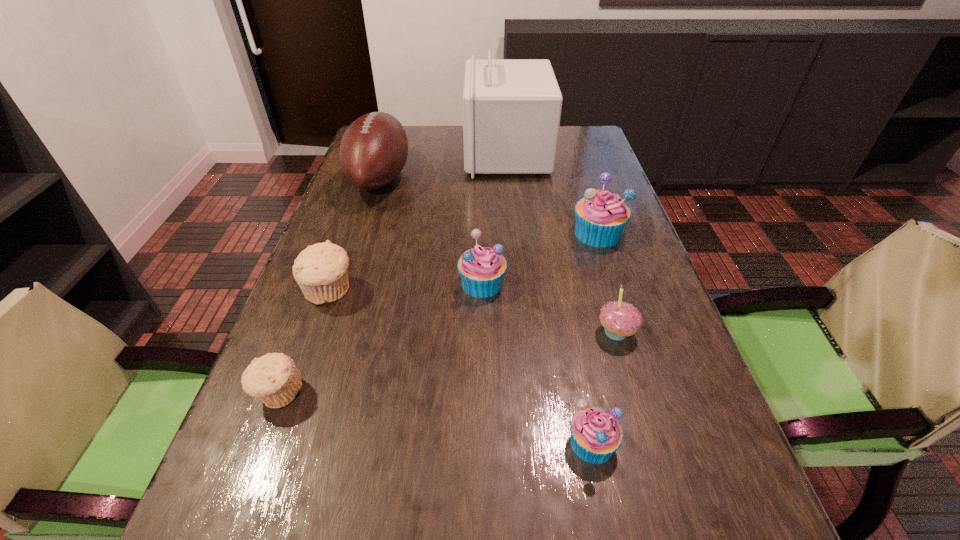
Locate an element on the screen. object that is at the far left corner is located at coordinates (374, 148).

This screenshot has width=960, height=540. What are the coordinates of `vacant area at the far edge of the desktop` in the screenshot? It's located at (439, 153).

Image resolution: width=960 pixels, height=540 pixels. I want to click on vacant space at the left edge, so click(x=295, y=463).

Image resolution: width=960 pixels, height=540 pixels. Identify the location of vacant area at the right edge of the desktop. (585, 168).

Identify the location of unoccupied position between the rightmost blue muffin and the second muffin from right to left. (595, 338).

At what (x,y) coordinates should I click in order to perform the action: click on vacant area between the farther beige muffin and the pink cupcake. Please return your answer as a coordinate pair (x, y). Image resolution: width=960 pixels, height=540 pixels. Looking at the image, I should click on (472, 312).

Identify the location of free space between the fourth muffin from left to right and the farther beige muffin. (460, 367).

You are a GUI agent. You are given a task and a screenshot of the screen. Output one action in this format:
    pyautogui.click(x=<x>, y=<y>)
    Task: Click on the empty location between the sixth shortest object and the seventh farthest object
    The image size is (960, 540).
    Given the screenshot: What is the action you would take?
    pyautogui.click(x=438, y=313)

The image size is (960, 540). I want to click on vacant point located between the second farthest blue muffin and the farther beige muffin, so click(405, 287).

Locate an element on the screen. free space between the second smallest blue muffin and the rightmost blue muffin is located at coordinates (540, 258).